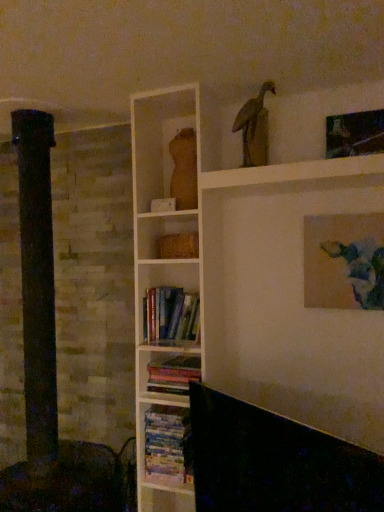
Question: Does hardcover books at center, marked as the first book in a top-to-bottom arrangement, appear on the left side of matte wooden torso at upper center?

Choices:
 (A) yes
 (B) no

Answer: (A)

Question: Considering the relative sizes of hardcover books at center, marked as the first book in a top-to-bottom arrangement, and matte wooden torso at upper center in the image provided, is hardcover books at center, marked as the first book in a top-to-bottom arrangement, shorter than matte wooden torso at upper center?

Choices:
 (A) yes
 (B) no

Answer: (A)

Question: Is hardcover books at center, marked as the third book in a bottom-to-top arrangement, outside of matte wooden torso at upper center?

Choices:
 (A) yes
 (B) no

Answer: (A)

Question: Can you confirm if hardcover books at center, marked as the third book in a bottom-to-top arrangement, is taller than matte wooden torso at upper center?

Choices:
 (A) yes
 (B) no

Answer: (B)

Question: Is hardcover books at center, marked as the first book in a top-to-bottom arrangement, beside matte wooden torso at upper center?

Choices:
 (A) no
 (B) yes

Answer: (A)

Question: Considering the relative sizes of hardcover books at center, marked as the third book in a bottom-to-top arrangement, and matte wooden torso at upper center in the image provided, is hardcover books at center, marked as the third book in a bottom-to-top arrangement, wider than matte wooden torso at upper center?

Choices:
 (A) yes
 (B) no

Answer: (A)

Question: From a real-world perspective, is hardcover books at center, positioned as the second book in bottom-to-top order, below wooden statue at upper center?

Choices:
 (A) yes
 (B) no

Answer: (A)

Question: From the image's perspective, does hardcover books at center, positioned as the second book in bottom-to-top order, appear lower than wooden statue at upper center?

Choices:
 (A) no
 (B) yes

Answer: (B)

Question: Are hardcover books at center, positioned as the second book in bottom-to-top order, and wooden statue at upper center beside each other?

Choices:
 (A) yes
 (B) no

Answer: (B)

Question: Considering the relative sizes of hardcover books at center, the second book when ordered from top to bottom, and wooden statue at upper center in the image provided, is hardcover books at center, the second book when ordered from top to bottom, smaller than wooden statue at upper center?

Choices:
 (A) no
 (B) yes

Answer: (A)

Question: Could wooden statue at upper center be considered to be inside hardcover books at center, the second book when ordered from top to bottom?

Choices:
 (A) no
 (B) yes

Answer: (A)

Question: Can you confirm if hardcover books at center, positioned as the second book in bottom-to-top order, is positioned to the left of wooden statue at upper center?

Choices:
 (A) no
 (B) yes

Answer: (B)

Question: Can you confirm if hardcover books at center, the 1th book ordered from the bottom, is smaller than matte wooden torso at upper center?

Choices:
 (A) no
 (B) yes

Answer: (A)